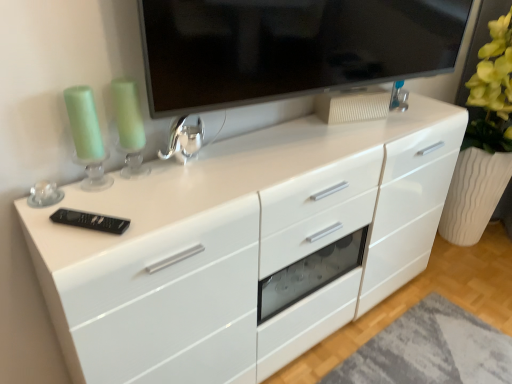
Measure the distance between shiny metallic faucet at center, which appears as the 2th appliance when viewed from the left, and camera.

The depth of shiny metallic faucet at center, which appears as the 2th appliance when viewed from the left, is 1.19 meters.

I want to click on matte black tv at upper center, so click(x=289, y=47).

Can you confirm if black plastic remote at lower left, which appears as the 2th appliance when viewed from the right, is positioned to the right of matte black tv at upper center?

In fact, black plastic remote at lower left, which appears as the 2th appliance when viewed from the right, is to the left of matte black tv at upper center.

Is matte black tv at upper center completely or partially inside black plastic remote at lower left, which appears as the 2th appliance when viewed from the right?

That's incorrect, matte black tv at upper center is not inside black plastic remote at lower left, which appears as the 2th appliance when viewed from the right.

Between black plastic remote at lower left, which appears as the 2th appliance when viewed from the right, and matte black tv at upper center, which one has larger width?

matte black tv at upper center.

Are black plastic remote at lower left, which appears as the 1th appliance when viewed from the left, and matte black tv at upper center beside each other?

There is a gap between black plastic remote at lower left, which appears as the 1th appliance when viewed from the left, and matte black tv at upper center.

Is shiny metallic faucet at center, which is the 2th appliance from front to back, bigger or smaller than white glossy chest of drawers at center?

Clearly, shiny metallic faucet at center, which is the 2th appliance from front to back, is smaller in size than white glossy chest of drawers at center.

Which object is closer to the camera taking this photo, shiny metallic faucet at center, the 1th appliance in the top-to-bottom sequence, or white glossy chest of drawers at center?

white glossy chest of drawers at center.

Is shiny metallic faucet at center, the 1th appliance in the top-to-bottom sequence, touching white glossy chest of drawers at center?

They are not placed beside each other.

Considering the relative positions of shiny metallic faucet at center, arranged as the 1th appliance when viewed from the right, and white glossy chest of drawers at center in the image provided, is shiny metallic faucet at center, arranged as the 1th appliance when viewed from the right, to the left of white glossy chest of drawers at center from the viewer's perspective?

Yes, shiny metallic faucet at center, arranged as the 1th appliance when viewed from the right, is to the left of white glossy chest of drawers at center.

From the image's perspective, relative to white glossy chest of drawers at center, is black plastic remote at lower left, which appears as the 2th appliance when viewed from the right, above or below?

Based on their image positions, black plastic remote at lower left, which appears as the 2th appliance when viewed from the right, is located above white glossy chest of drawers at center.

From a real-world perspective, which object rests below the other?

white glossy chest of drawers at center.

Which point is more forward, (78, 218) or (106, 210)?

The point (78, 218) is closer to the camera.

Who is smaller, white glossy chest of drawers at center or shiny metallic faucet at center, which is the 1th appliance in back-to-front order?

With smaller size is shiny metallic faucet at center, which is the 1th appliance in back-to-front order.

Consider the image. Which object is wider, white glossy chest of drawers at center or shiny metallic faucet at center, which is the 2th appliance from front to back?

With larger width is white glossy chest of drawers at center.

Is white glossy chest of drawers at center turned away from shiny metallic faucet at center, which appears as the 2th appliance when viewed from the left?

That's not correct — white glossy chest of drawers at center is not looking away from shiny metallic faucet at center, which appears as the 2th appliance when viewed from the left.

Is white glossy chest of drawers at center positioned beyond the bounds of shiny metallic faucet at center, the 1th appliance in the top-to-bottom sequence?

Yes.

Which is further, (79, 364) or (87, 214)?

The point (87, 214) is farther from the camera.

How many degrees apart are the facing directions of white glossy chest of drawers at center and black plastic remote at lower left, the 1th appliance ordered from the bottom?

There is a 36.8-degree angle between the facing directions of white glossy chest of drawers at center and black plastic remote at lower left, the 1th appliance ordered from the bottom.

From their relative heights in the image, would you say white glossy chest of drawers at center is taller or shorter than black plastic remote at lower left, which appears as the 1th appliance when viewed from the left?

Considering their sizes, white glossy chest of drawers at center has more height than black plastic remote at lower left, which appears as the 1th appliance when viewed from the left.

In terms of size, does white glossy chest of drawers at center appear bigger or smaller than black plastic remote at lower left, which appears as the 2th appliance when viewed from the right?

Considering their sizes, white glossy chest of drawers at center takes up more space than black plastic remote at lower left, which appears as the 2th appliance when viewed from the right.

Could you tell me if black plastic remote at lower left, the 1th appliance ordered from the bottom, is turned towards shiny metallic faucet at center, arranged as the 1th appliance when viewed from the right?

No.

Is black plastic remote at lower left, positioned as the second appliance in back-to-front order, to the right of shiny metallic faucet at center, which appears as the 2th appliance when viewed from the left, from the viewer's perspective?

Incorrect, black plastic remote at lower left, positioned as the second appliance in back-to-front order, is not on the right side of shiny metallic faucet at center, which appears as the 2th appliance when viewed from the left.

Where is `appliance that is above the black plastic remote at lower left, acting as the 2th appliance starting from the top (from the image's perspective)`? appliance that is above the black plastic remote at lower left, acting as the 2th appliance starting from the top (from the image's perspective) is located at coordinates (184, 140).

Looking at this image, would you say black plastic remote at lower left, the 1th appliance in the front-to-back sequence, is inside or outside shiny metallic faucet at center, which appears as the 2th appliance when viewed from the left?

black plastic remote at lower left, the 1th appliance in the front-to-back sequence, exists outside the volume of shiny metallic faucet at center, which appears as the 2th appliance when viewed from the left.

Between shiny metallic faucet at center, arranged as the 1th appliance when viewed from the right, and black plastic remote at lower left, acting as the 2th appliance starting from the top, which one has larger size?

shiny metallic faucet at center, arranged as the 1th appliance when viewed from the right.

From a real-world perspective, is shiny metallic faucet at center, the 1th appliance in the top-to-bottom sequence, above or below black plastic remote at lower left, which appears as the 2th appliance when viewed from the right?

Clearly, from a real-world perspective, shiny metallic faucet at center, the 1th appliance in the top-to-bottom sequence, is above black plastic remote at lower left, which appears as the 2th appliance when viewed from the right.

Is shiny metallic faucet at center, which is the 2th appliance from front to back, directly adjacent to black plastic remote at lower left, positioned as the second appliance in back-to-front order?

No, shiny metallic faucet at center, which is the 2th appliance from front to back, is not in contact with black plastic remote at lower left, positioned as the second appliance in back-to-front order.

Find the location of `television on the right of black plastic remote at lower left, which appears as the 2th appliance when viewed from the right`. television on the right of black plastic remote at lower left, which appears as the 2th appliance when viewed from the right is located at coordinates (289, 47).

Locate an element on the screen. the 2nd appliance behind when counting from the white glossy chest of drawers at center is located at coordinates (184, 140).

Based on their spatial positions, is black plastic remote at lower left, the 1th appliance ordered from the bottom, or white glossy chest of drawers at center further from shiny metallic faucet at center, which appears as the 2th appliance when viewed from the left?

Among the two, white glossy chest of drawers at center is located further to shiny metallic faucet at center, which appears as the 2th appliance when viewed from the left.

Which object lies nearer to the anchor point black plastic remote at lower left, the 1th appliance ordered from the bottom, white glossy chest of drawers at center or shiny metallic faucet at center, which is the 1th appliance in back-to-front order?

shiny metallic faucet at center, which is the 1th appliance in back-to-front order, is positioned closer to the anchor black plastic remote at lower left, the 1th appliance ordered from the bottom.

Estimate the real-world distances between objects in this image. Which object is closer to black plastic remote at lower left, the 1th appliance ordered from the bottom, shiny metallic faucet at center, which is the 1th appliance in back-to-front order, or white glossy chest of drawers at center?

Based on the image, shiny metallic faucet at center, which is the 1th appliance in back-to-front order, appears to be nearer to black plastic remote at lower left, the 1th appliance ordered from the bottom.

Which object lies further to the anchor point white glossy chest of drawers at center, shiny metallic faucet at center, which is the 2th appliance from front to back, or black plastic remote at lower left, the 1th appliance ordered from the bottom?

black plastic remote at lower left, the 1th appliance ordered from the bottom, is positioned further to the anchor white glossy chest of drawers at center.

Based on their spatial positions, is black plastic remote at lower left, the 1th appliance in the front-to-back sequence, or white glossy chest of drawers at center further from matte black tv at upper center?

black plastic remote at lower left, the 1th appliance in the front-to-back sequence, lies further to matte black tv at upper center than the other object.

Based on their spatial positions, is matte black tv at upper center or black plastic remote at lower left, which appears as the 1th appliance when viewed from the left, closer to shiny metallic faucet at center, which appears as the 2th appliance when viewed from the left?

black plastic remote at lower left, which appears as the 1th appliance when viewed from the left, is closer to shiny metallic faucet at center, which appears as the 2th appliance when viewed from the left.

When comparing their distances from white glossy chest of drawers at center, does matte black tv at upper center or black plastic remote at lower left, positioned as the second appliance in back-to-front order, seem closer?

matte black tv at upper center is closer to white glossy chest of drawers at center.

Considering their positions, is black plastic remote at lower left, positioned as the second appliance in back-to-front order, positioned further to shiny metallic faucet at center, which is the 2th appliance from front to back, than matte black tv at upper center?

matte black tv at upper center.

At what (x,y) coordinates should I click in order to perform the action: click on appliance situated between black plastic remote at lower left, which appears as the 1th appliance when viewed from the left, and white glossy chest of drawers at center from left to right. Please return your answer as a coordinate pair (x, y). This screenshot has height=384, width=512. Looking at the image, I should click on (184, 140).

Where is `appliance located between black plastic remote at lower left, acting as the 2th appliance starting from the top, and matte black tv at upper center in the left-right direction`? The height and width of the screenshot is (384, 512). appliance located between black plastic remote at lower left, acting as the 2th appliance starting from the top, and matte black tv at upper center in the left-right direction is located at coordinates (184, 140).